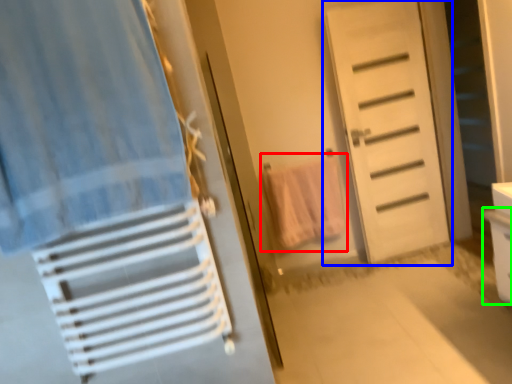
Question: Based on their relative distances, which object is nearer to beach towel (highlighted by a red box)? Choose from door (highlighted by a blue box) and drawer (highlighted by a green box).

Choices:
 (A) door
 (B) drawer

Answer: (A)